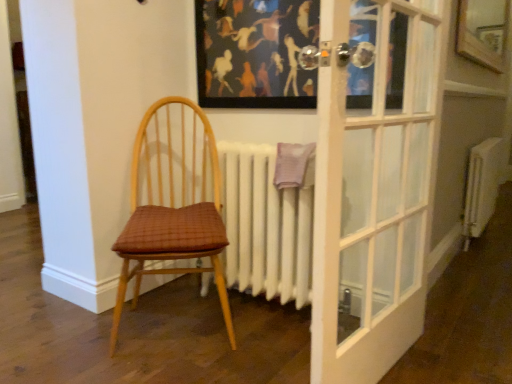
Question: In terms of size, does wooden frame at upper right appear bigger or smaller than matte black picture frame at upper center?

Choices:
 (A) small
 (B) big

Answer: (B)

Question: Is point (487, 62) closer or farther from the camera than point (295, 13)?

Choices:
 (A) farther
 (B) closer

Answer: (A)

Question: Which object is the farthest from the matte black picture frame at upper center?

Choices:
 (A) white matte radiator at center, the 2th radiator from the back
 (B) wooden frame at upper right
 (C) white metallic radiator at right, which is the 1th radiator in back-to-front order
 (D) wooden chair with woven seat cushion at left

Answer: (C)

Question: Based on their relative distances, which object is farther from the matte black picture frame at upper center?

Choices:
 (A) wooden chair with woven seat cushion at left
 (B) wooden frame at upper right
 (C) white metallic radiator at right, the 2th radiator from the left
 (D) white matte radiator at center, the 2th radiator from the back

Answer: (C)